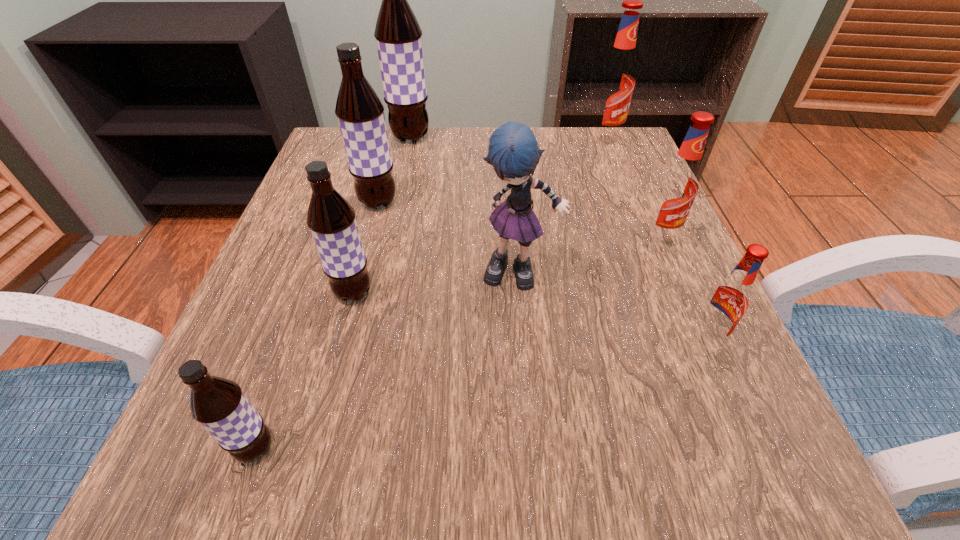
At what (x,y) coordinates should I click in order to perform the action: click on the third nearest root beer. Please return your answer as a coordinate pair (x, y). Looking at the image, I should click on (331, 219).

Image resolution: width=960 pixels, height=540 pixels. In order to click on the smallest red root beer in this screenshot , I will do `click(728, 301)`.

Find the location of a particular element. The height and width of the screenshot is (540, 960). the second nearest root beer is located at coordinates (728, 301).

Where is `the leftmost brown root beer`? This screenshot has height=540, width=960. the leftmost brown root beer is located at coordinates (218, 404).

Identify the location of the leftmost object. The image size is (960, 540). (218, 404).

The height and width of the screenshot is (540, 960). I want to click on vacant space situated on the left of the tallest root beer, so click(x=353, y=137).

Image resolution: width=960 pixels, height=540 pixels. In order to click on vacant space situated on the front of the farthest red root beer in this screenshot , I will do `click(616, 173)`.

The width and height of the screenshot is (960, 540). I want to click on blank space located 0.220m on the front of the third nearest brown root beer, so click(352, 299).

This screenshot has height=540, width=960. I want to click on vacant space located on the front-facing side of the blue rag doll, so click(x=528, y=373).

Image resolution: width=960 pixels, height=540 pixels. I want to click on vacant area situated on the left of the fifth nearest object, so click(507, 237).